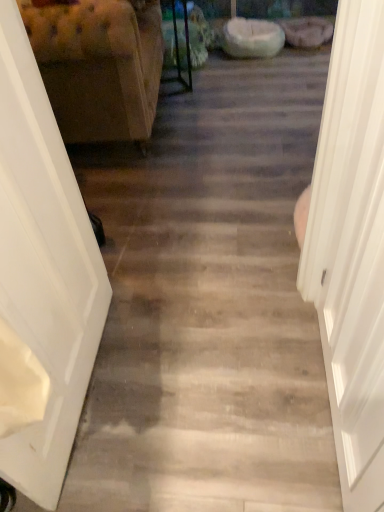
Question: Considering the positions of point (31, 263) and point (39, 12), is point (31, 263) closer or farther from the camera than point (39, 12)?

Choices:
 (A) closer
 (B) farther

Answer: (A)

Question: Looking at their shapes, would you say white glossy door at left, positioned as the second door in right-to-left order, is wider or thinner than tufted fabric armchair at left?

Choices:
 (A) thin
 (B) wide

Answer: (A)

Question: Estimate the real-world distances between objects in this image. Which object is closer to the white smooth door at right, placed as the 2th door when sorted from left to right?

Choices:
 (A) tufted fabric armchair at left
 (B) white glossy door at left, the 1th door viewed from the left

Answer: (B)

Question: Which object is the farthest from the white smooth door at right, the 1th door viewed from the right?

Choices:
 (A) white glossy door at left, positioned as the second door in right-to-left order
 (B) tufted fabric armchair at left

Answer: (B)